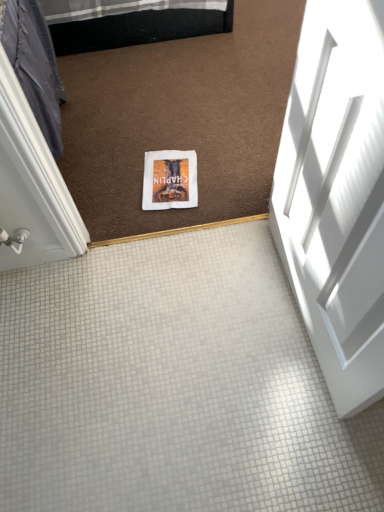
Question: Based on their positions, is white paper at center located to the left or right of white glossy door at right?

Choices:
 (A) right
 (B) left

Answer: (B)

Question: Is white paper at center inside the boundaries of white glossy door at right, or outside?

Choices:
 (A) inside
 (B) outside

Answer: (B)

Question: Is point (185, 177) positioned closer to the camera than point (347, 28)?

Choices:
 (A) farther
 (B) closer

Answer: (A)

Question: In the image, is white glossy door at right on the left side or the right side of white paper at center?

Choices:
 (A) left
 (B) right

Answer: (B)

Question: From the image's perspective, relative to white paper at center, is white glossy door at right above or below?

Choices:
 (A) above
 (B) below

Answer: (B)

Question: In the image, is white glossy door at right positioned in front of or behind white paper at center?

Choices:
 (A) front
 (B) behind

Answer: (A)

Question: Does point (329, 322) appear closer or farther from the camera than point (175, 194)?

Choices:
 (A) closer
 (B) farther

Answer: (A)